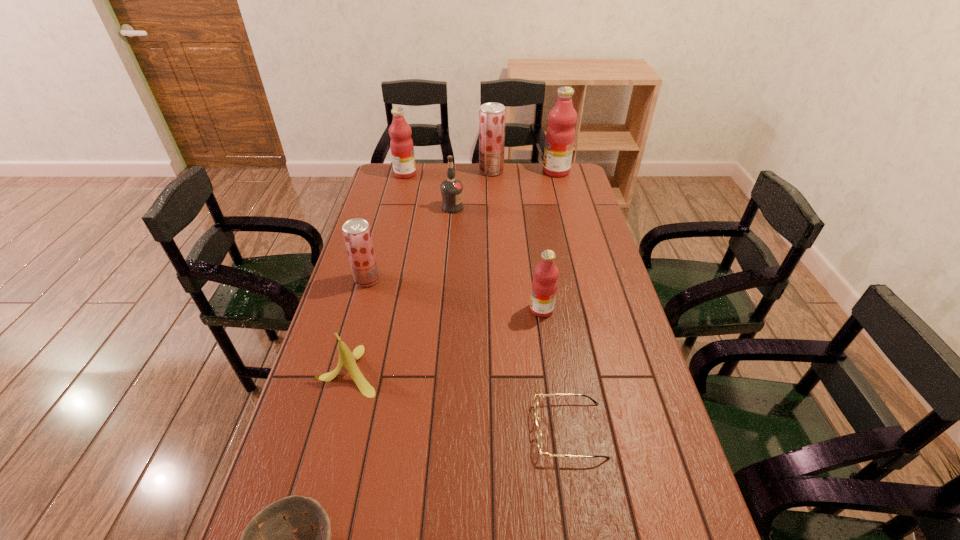
The height and width of the screenshot is (540, 960). In order to click on the rightmost fruit juice in this screenshot , I will do `click(560, 135)`.

Identify the location of the rightmost pink fruit juice. This screenshot has height=540, width=960. (560, 135).

Identify the location of the bigger strawberry fruit juice. The width and height of the screenshot is (960, 540). (492, 115).

This screenshot has height=540, width=960. What are the coordinates of `the right strawberry fruit juice` in the screenshot? It's located at (492, 115).

You are a GUI agent. You are given a task and a screenshot of the screen. Output one action in this format:
    pyautogui.click(x=<x>, y=<y>)
    Task: Click on the leftmost pink fruit juice
    This screenshot has height=540, width=960.
    Given the screenshot: What is the action you would take?
    pyautogui.click(x=402, y=149)

At what (x,y) coordinates should I click in order to perform the action: click on vodka. Please return your answer as a coordinate pair (x, y). Image resolution: width=960 pixels, height=540 pixels. Looking at the image, I should click on (451, 189).

Identify the location of the fifth object from right to left. (451, 189).

I want to click on the fourth nearest object, so click(544, 285).

Locate an element on the screen. The height and width of the screenshot is (540, 960). the nearest fruit juice is located at coordinates (544, 285).

This screenshot has height=540, width=960. I want to click on the left strawberry fruit juice, so click(357, 235).